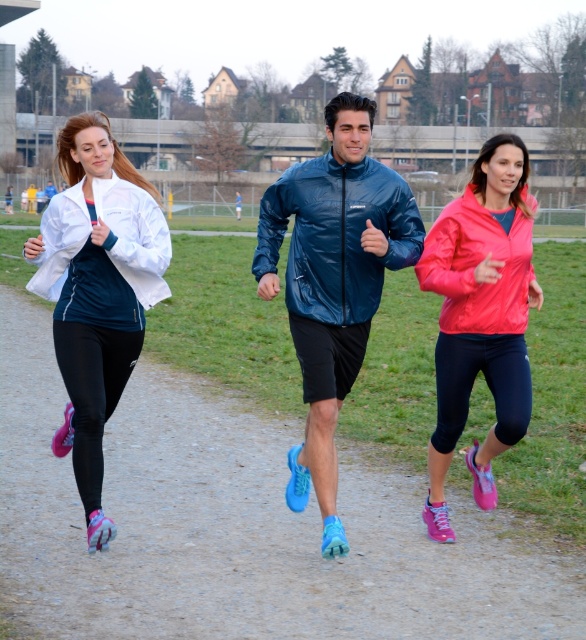
Between point (403, 211) and point (305, 202), which one is positioned in front?

Point (305, 202)

What do you see at coordinates (332, 282) in the screenshot? I see `shiny blue jacket at center` at bounding box center [332, 282].

Where is `shiny blue jacket at center`? shiny blue jacket at center is located at coordinates (332, 282).

Does matte blue sneakers at center have a greater width compared to shiny blue jacket at center?

Indeed, matte blue sneakers at center has a greater width compared to shiny blue jacket at center.

What do you see at coordinates (240, 525) in the screenshot?
I see `matte blue sneakers at center` at bounding box center [240, 525].

Between point (265, 497) and point (322, 211), which one is positioned behind?

Point (265, 497)

Identify the location of matte blue sneakers at center. (240, 525).

Does matte blue jacket at center have a lesser width compared to white matte jacket at left?

Incorrect, matte blue jacket at center's width is not less than white matte jacket at left's.

Measure the distance between matte blue jacket at center and camera.

The distance of matte blue jacket at center from camera is 6.16 meters.

I want to click on matte blue jacket at center, so click(338, 280).